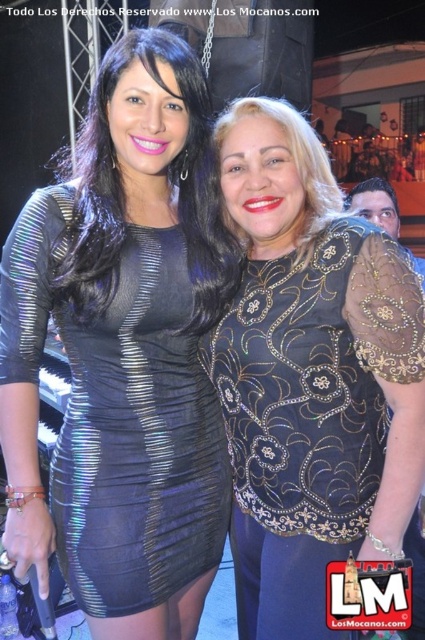
From the picture: You are a photographer at the event and want to position a spotlight exactly at the center of the metallic black dress at center. According to the coordinates provided, where should you aim the spotlight?

The metallic black dress at center is located at coordinates point (124, 353), so you should aim the spotlight at point (124, 353) to center it.

You are at a party and want to take a photo with both the metallic black dress at center and the black sequined blouse at right. Since you can only focus on one at a time, which one should you focus on to ensure the other appears in the background?

The metallic black dress at center is located above the black sequined blouse at right, so focusing on the metallic black dress at center will place the black sequined blouse at right in the background.